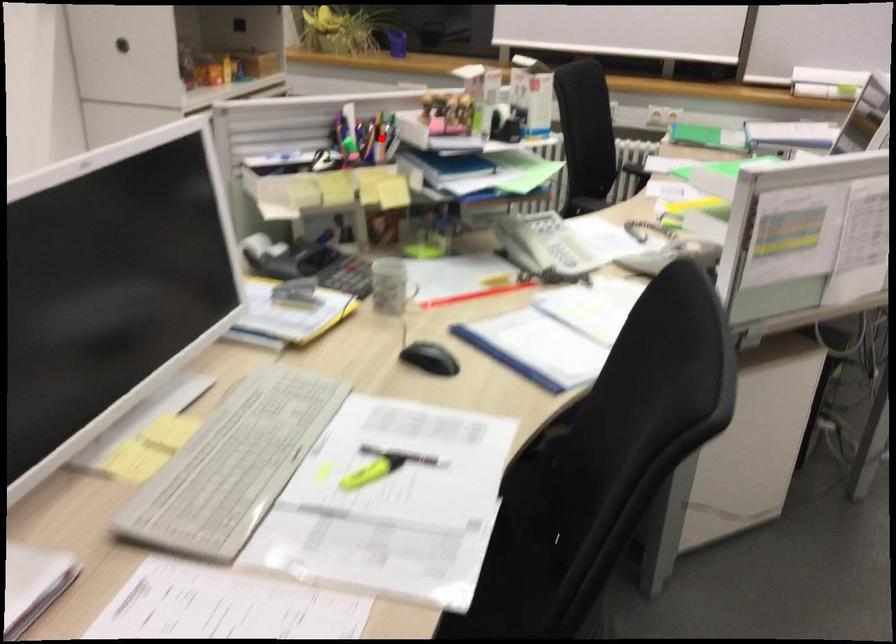
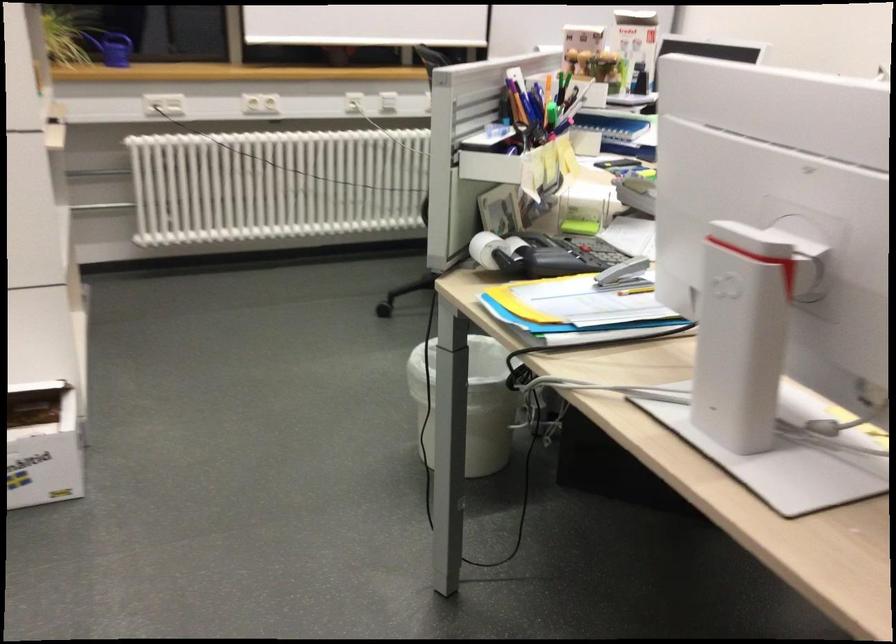
The point at the highlighted location is marked in the first image. Where is the corresponding point in the second image?

(547, 98)